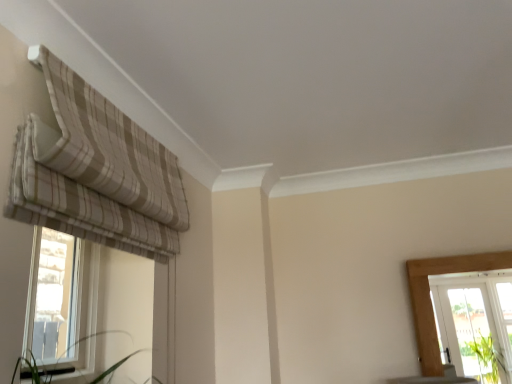
Question: Should I look upward or downward to see clear glass window at left?

Choices:
 (A) down
 (B) up

Answer: (A)

Question: From a real-world perspective, is beige striped fabric at upper left located beneath clear glass window at left?

Choices:
 (A) yes
 (B) no

Answer: (B)

Question: Is beige striped fabric at upper left positioned behind clear glass window at left?

Choices:
 (A) no
 (B) yes

Answer: (A)

Question: Can you confirm if beige striped fabric at upper left is smaller than clear glass window at left?

Choices:
 (A) no
 (B) yes

Answer: (A)

Question: Is the surface of beige striped fabric at upper left in direct contact with clear glass window at left?

Choices:
 (A) no
 (B) yes

Answer: (A)

Question: Is beige striped fabric at upper left turned away from clear glass window at left?

Choices:
 (A) yes
 (B) no

Answer: (B)

Question: From a real-world perspective, does beige striped fabric at upper left stand above clear glass window at left?

Choices:
 (A) yes
 (B) no

Answer: (A)

Question: Is clear glass window at left to the left of beige striped fabric at upper left from the viewer's perspective?

Choices:
 (A) yes
 (B) no

Answer: (A)

Question: Is clear glass window at left shorter than beige striped fabric at upper left?

Choices:
 (A) no
 (B) yes

Answer: (A)

Question: Is clear glass window at left outside beige striped fabric at upper left?

Choices:
 (A) no
 (B) yes

Answer: (B)

Question: Does clear glass window at left have a lesser width compared to beige striped fabric at upper left?

Choices:
 (A) yes
 (B) no

Answer: (A)

Question: Does clear glass window at left have a greater width compared to beige striped fabric at upper left?

Choices:
 (A) no
 (B) yes

Answer: (A)

Question: Considering the relative positions of clear glass window at left and beige striped fabric at upper left in the image provided, is clear glass window at left to the right of beige striped fabric at upper left from the viewer's perspective?

Choices:
 (A) yes
 (B) no

Answer: (B)

Question: Considering the positions of beige striped fabric at upper left and clear glass window at left in the image, is beige striped fabric at upper left taller or shorter than clear glass window at left?

Choices:
 (A) tall
 (B) short

Answer: (B)